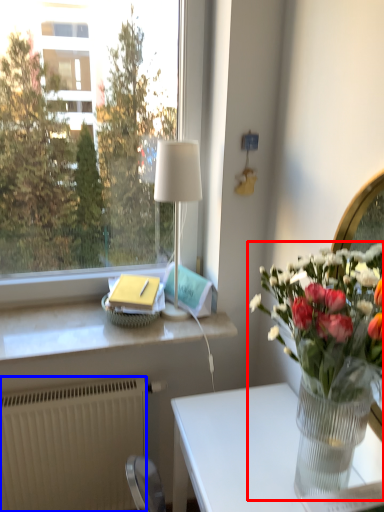
Question: Which object is further to the camera taking this photo, houseplant (highlighted by a red box) or radiator (highlighted by a blue box)?

Choices:
 (A) houseplant
 (B) radiator

Answer: (B)